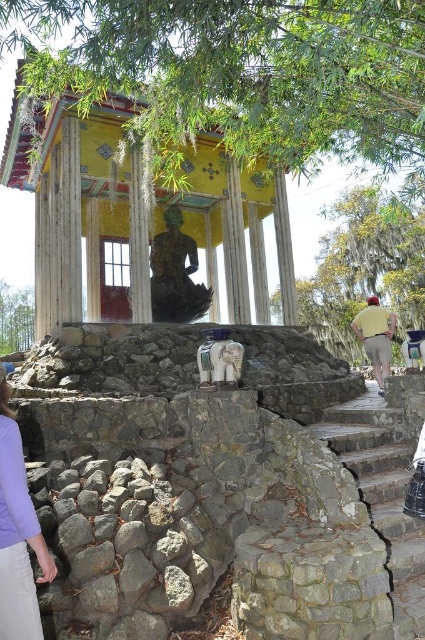
You are standing at the entrance of the yellow painted wood gazebo at center and want to walk towards the gray stone stairs at lower right. Which direction should you move to reach the stairs?

You should move to your right because the yellow painted wood gazebo at center is to the left of gray stone stairs at lower right, so moving right from the gazebo will lead you towards the stairs.

You are standing at the base of the gray stone stairs at lower right and want to reach the yellow cotton shirt at right. Which direction should you move to get closer to the shirt?

To reach the yellow cotton shirt at right from the gray stone stairs at lower right, you should move towards the right direction since the shirt is positioned to the right side of the stairs.